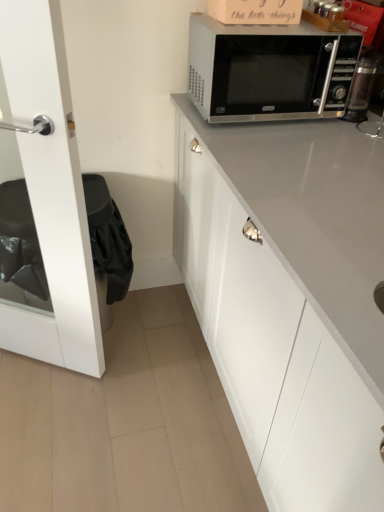
Locate an element on the screen. The height and width of the screenshot is (512, 384). free space in front of white glossy door at left is located at coordinates (42, 420).